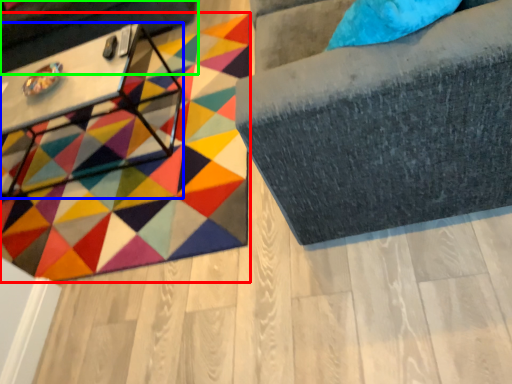
Question: Based on their relative distances, which object is nearer to mat (highlighted by a red box)? Choose from table (highlighted by a blue box) and swivel chair (highlighted by a green box).

Choices:
 (A) table
 (B) swivel chair

Answer: (A)